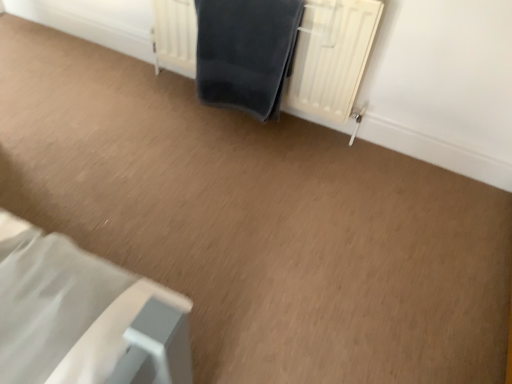
Question: In the image, is white textured radiator at upper center positioned in front of or behind dark blue fabric at center?

Choices:
 (A) behind
 (B) front

Answer: (B)

Question: From a real-world perspective, is white textured radiator at upper center above or below dark blue fabric at center?

Choices:
 (A) below
 (B) above

Answer: (A)

Question: From the image's perspective, relative to dark blue fabric at center, is white textured radiator at upper center above or below?

Choices:
 (A) above
 (B) below

Answer: (A)

Question: From a real-world perspective, is dark blue fabric at center physically located above or below white textured radiator at upper center?

Choices:
 (A) below
 (B) above

Answer: (B)

Question: From the image's perspective, is dark blue fabric at center above or below white textured radiator at upper center?

Choices:
 (A) above
 (B) below

Answer: (B)

Question: In the image, is dark blue fabric at center positioned in front of or behind white textured radiator at upper center?

Choices:
 (A) front
 (B) behind

Answer: (B)

Question: Would you say dark blue fabric at center is inside or outside white textured radiator at upper center?

Choices:
 (A) outside
 (B) inside

Answer: (B)